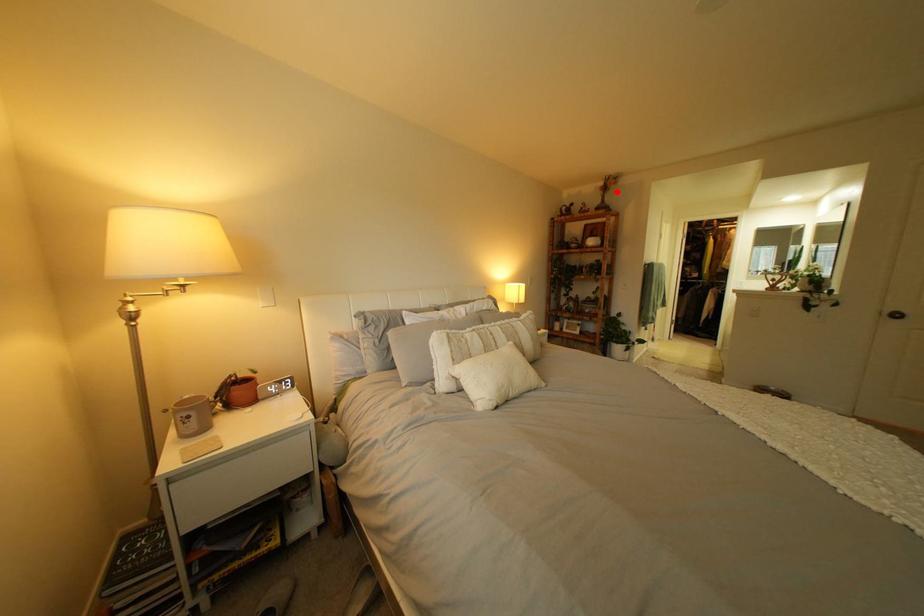
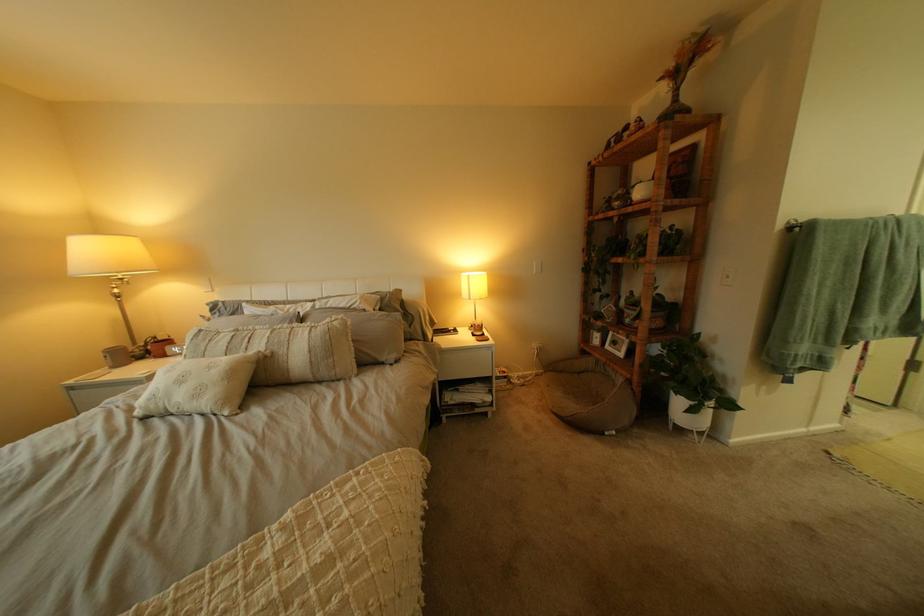
Question: I am providing you with two images of the same scene from different viewpoints. Given a red point in image1, look at the same physical point in image2. Is it:

Choices:
 (A) Closer to the viewpoint
 (B) Farther from the viewpoint

Answer: (B)